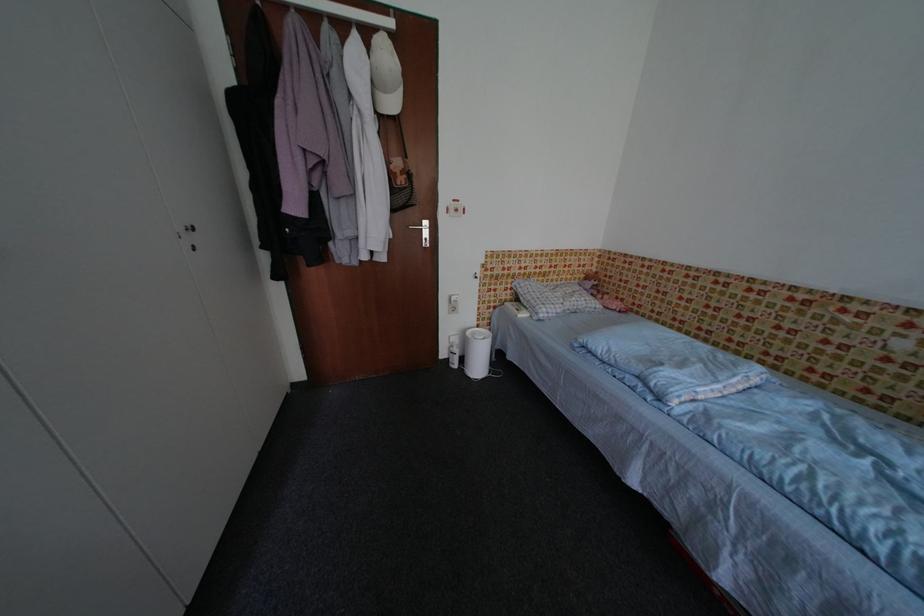
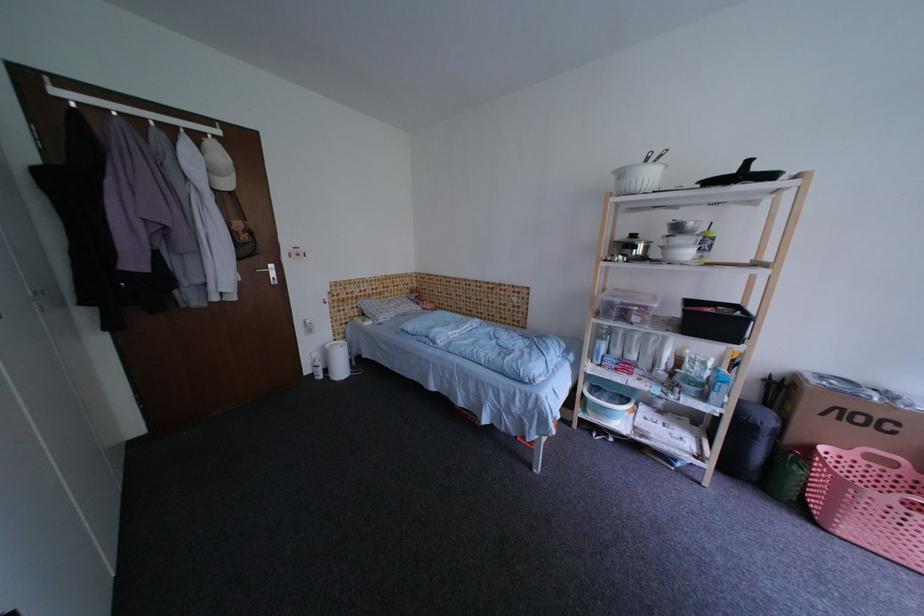
In the second image, find the point that corresponds to (451,357) in the first image.

(314, 374)